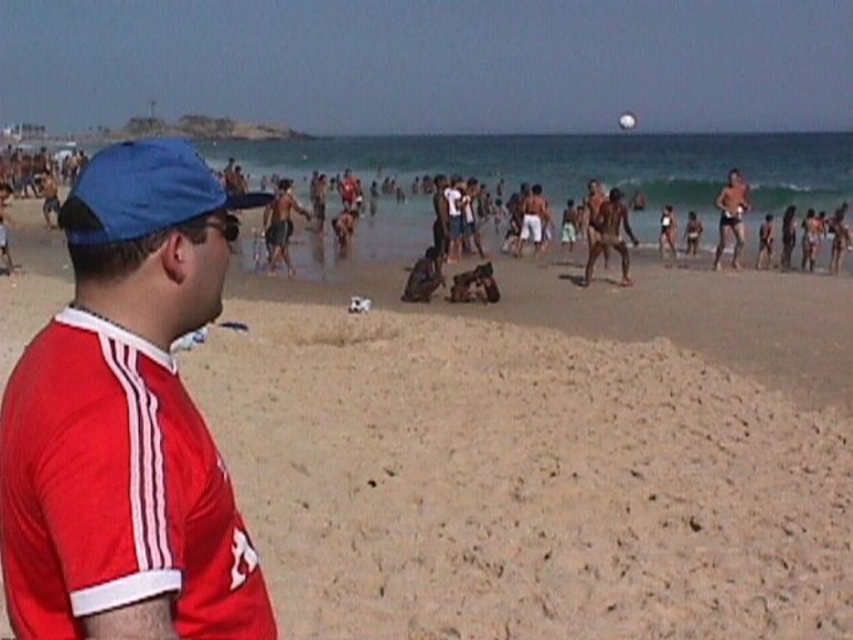
Which of these two, beige sandy beach at center or red matte jersey at left, stands taller?

Standing taller between the two is beige sandy beach at center.

Between beige sandy beach at center and red matte jersey at left, which one appears on the right side from the viewer's perspective?

From the viewer's perspective, red matte jersey at left appears more on the right side.

This screenshot has height=640, width=853. Describe the element at coordinates (543, 460) in the screenshot. I see `beige sandy beach at center` at that location.

The image size is (853, 640). Identify the location of beige sandy beach at center. (543, 460).

Who is shorter, red matte jersey at left or smooth tan skin at right?

red matte jersey at left

Who is taller, red matte jersey at left or smooth tan skin at right?

smooth tan skin at right

Is point (165, 225) in front of point (743, 196)?

Yes, point (165, 225) is in front of point (743, 196).

The image size is (853, 640). I want to click on red matte jersey at left, so click(126, 420).

Between point (764, 449) and point (718, 209), which one is positioned in front?

Point (764, 449)

Between point (314, 509) and point (733, 227), which one is positioned behind?

Positioned behind is point (733, 227).

The width and height of the screenshot is (853, 640). Find the location of `beige sandy beach at center`. beige sandy beach at center is located at coordinates (543, 460).